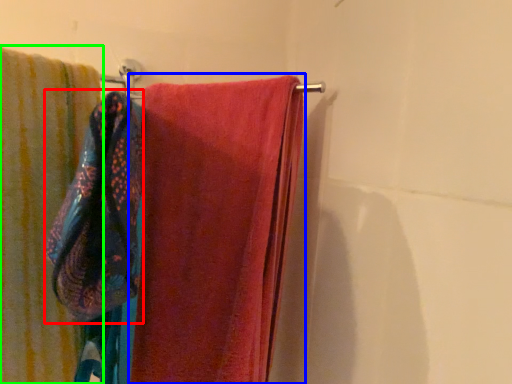
Question: Estimate the real-world distances between objects in this image. Which object is closer to beach towel (highlighted by a red box), towel (highlighted by a blue box) or towel (highlighted by a green box)?

Choices:
 (A) towel
 (B) towel

Answer: (B)